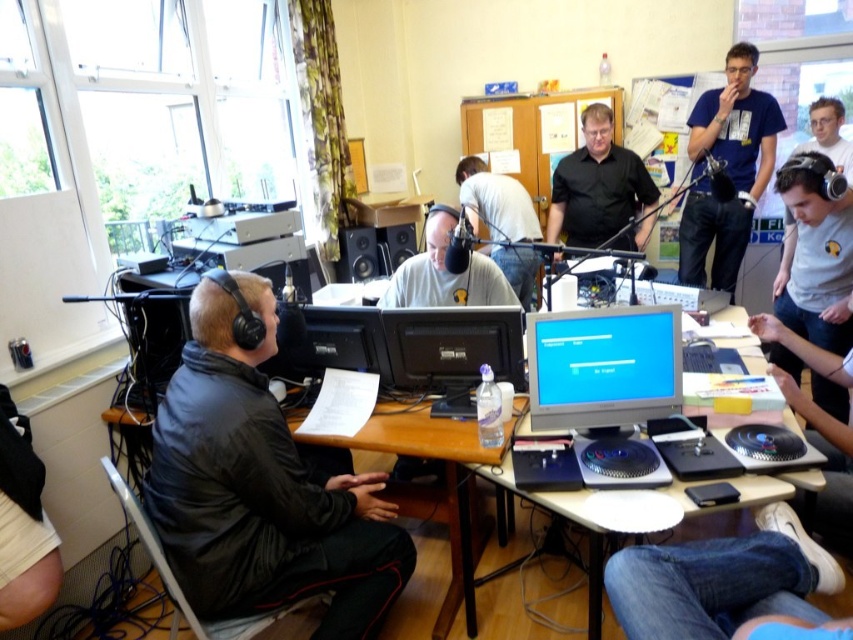
Question: Is blue t-shirt at upper right to the left of black matte shirt at center from the viewer's perspective?

Choices:
 (A) no
 (B) yes

Answer: (A)

Question: Estimate the real-world distances between objects in this image. Which object is farther from the matte plastic monitor at center?

Choices:
 (A) light gray shirt at center
 (B) black matte monitor at center
 (C) matte black monitor at center
 (D) black matte shirt at center

Answer: (D)

Question: Which object is positioned closest to the black matte jacket at left?

Choices:
 (A) matte black monitor at center
 (B) matte plastic monitor at center
 (C) black matte monitor at center
 (D) blue t-shirt at upper right

Answer: (C)

Question: Is matte plastic monitor at center in front of black matte monitor at center?

Choices:
 (A) yes
 (B) no

Answer: (A)

Question: Which object is positioned closest to the matte gray shirt at center?

Choices:
 (A) light gray shirt at center
 (B) blue t-shirt at upper right
 (C) black matte jacket at left
 (D) black matte shirt at center

Answer: (C)

Question: Is matte gray shirt at center positioned at the back of matte black monitor at center?

Choices:
 (A) yes
 (B) no

Answer: (A)